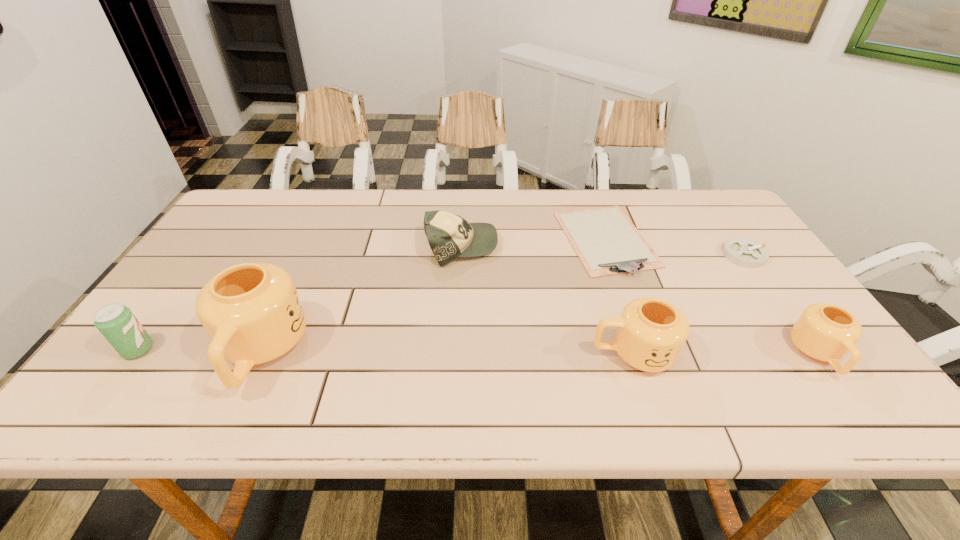
The width and height of the screenshot is (960, 540). Find the location of `vacant space located on the handle side of the second shortest mug`. vacant space located on the handle side of the second shortest mug is located at coordinates (512, 354).

Identify the location of free space located 0.160m on the handle side of the second shortest mug. The image size is (960, 540). (520, 354).

The width and height of the screenshot is (960, 540). Identify the location of vacant region located on the right of the clipboard. (719, 239).

Find the location of a particular element. This screenshot has width=960, height=540. vacant space located on the front-facing side of the fifth tallest object is located at coordinates (623, 246).

Where is `free space located 0.250m on the back of the sixth tallest object`? free space located 0.250m on the back of the sixth tallest object is located at coordinates (704, 198).

Identify the location of vacant area situated on the right of the soda. (275, 349).

Locate an element on the screen. This screenshot has width=960, height=540. clipboard positioned at the far edge is located at coordinates (607, 243).

Identify the location of baseball cap located in the far edge section of the desktop. (450, 236).

This screenshot has height=540, width=960. I want to click on soda that is at the near edge, so click(116, 322).

You are a GUI agent. You are given a task and a screenshot of the screen. Output one action in this format:
    pyautogui.click(x=<x>, y=<y>)
    Task: Click on the object located in the left edge section of the desktop
    This screenshot has width=960, height=540.
    Given the screenshot: What is the action you would take?
    pyautogui.click(x=116, y=322)